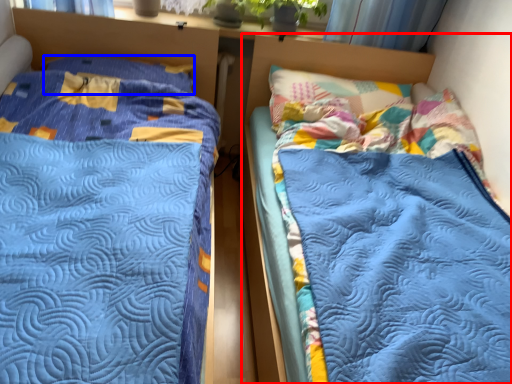
Question: Which point is closer to the camera, bed (highlighted by a red box) or pillow (highlighted by a blue box)?

Choices:
 (A) bed
 (B) pillow

Answer: (A)